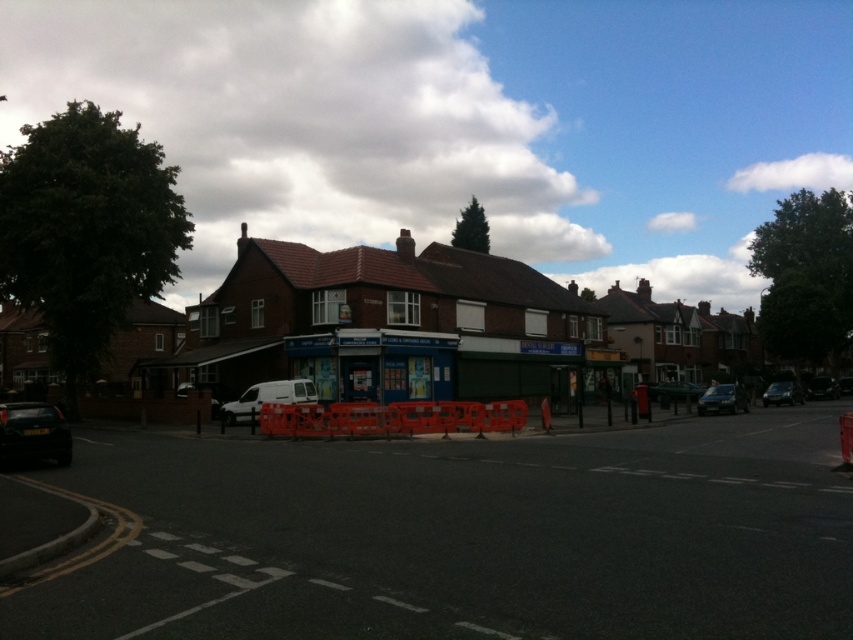
Is black asphalt road at center further to the viewer compared to white matte van at center?

No, it is not.

This screenshot has width=853, height=640. What are the coordinates of `black asphalt road at center` in the screenshot? It's located at (462, 536).

Describe the element at coordinates (375, 364) in the screenshot. I see `blue painted bus stop at center` at that location.

Consider the image. Does blue painted bus stop at center appear on the left side of white matte van at center?

In fact, blue painted bus stop at center is to the right of white matte van at center.

Locate an element on the screen. The width and height of the screenshot is (853, 640). blue painted bus stop at center is located at coordinates (375, 364).

Where is `black asphalt road at center`? black asphalt road at center is located at coordinates (462, 536).

Who is more forward, (x=659, y=474) or (x=703, y=403)?

Point (x=659, y=474)

You are a GUI agent. You are given a task and a screenshot of the screen. Output one action in this format:
    pyautogui.click(x=<x>, y=<y>)
    Task: Click on the black asphalt road at center
    The height and width of the screenshot is (640, 853).
    Given the screenshot: What is the action you would take?
    pyautogui.click(x=462, y=536)